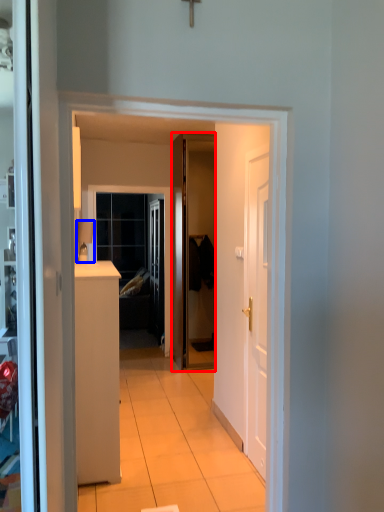
Question: Which of the following is the farthest to the observer, door (highlighted by a red box) or lamp (highlighted by a blue box)?

Choices:
 (A) door
 (B) lamp

Answer: (A)